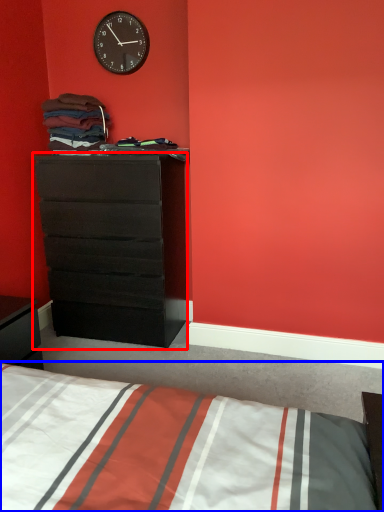
Question: Which object is further to the camera taking this photo, chest of drawers (highlighted by a red box) or bed (highlighted by a blue box)?

Choices:
 (A) chest of drawers
 (B) bed

Answer: (A)